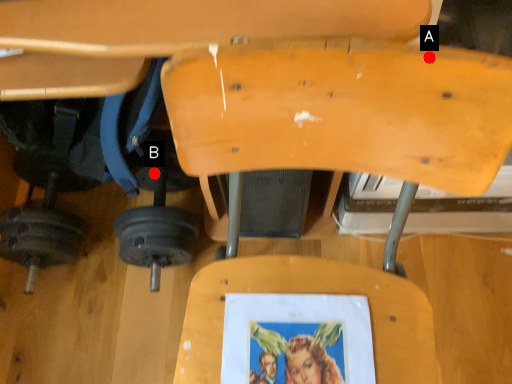
Question: Two points are circled on the image, labeled by A and B beside each circle. Which point is farther to the camera?

Choices:
 (A) A is further
 (B) B is further

Answer: (B)